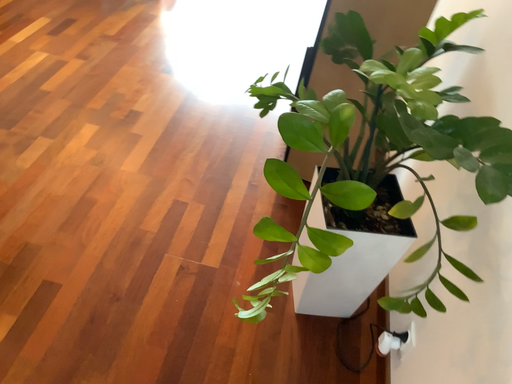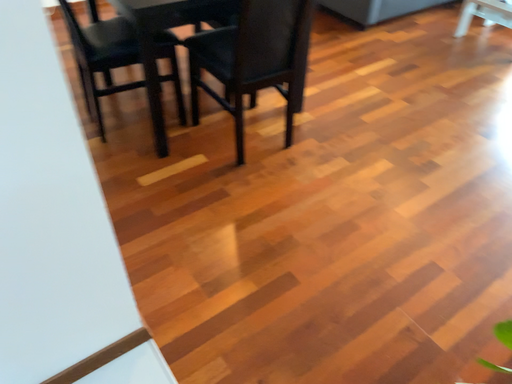
Question: How did the camera likely rotate when shooting the video?

Choices:
 (A) rotated downward
 (B) rotated upward

Answer: (B)